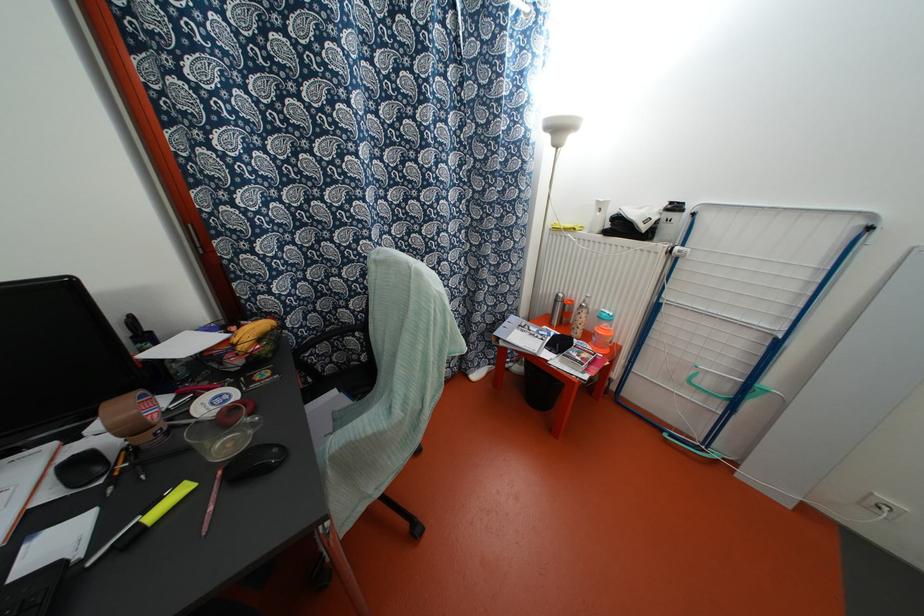
Where is `silver thermos bottle`? This screenshot has height=616, width=924. silver thermos bottle is located at coordinates click(x=555, y=309).